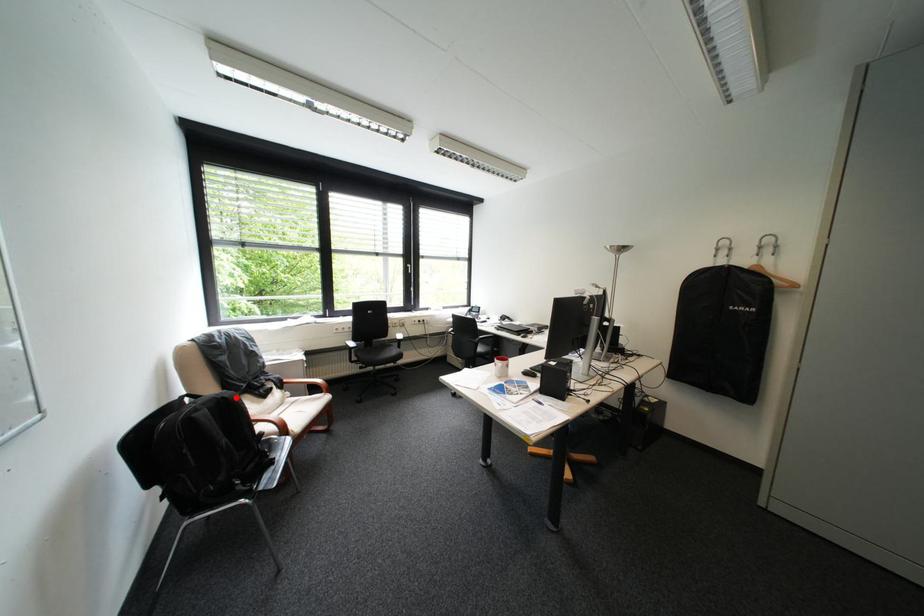
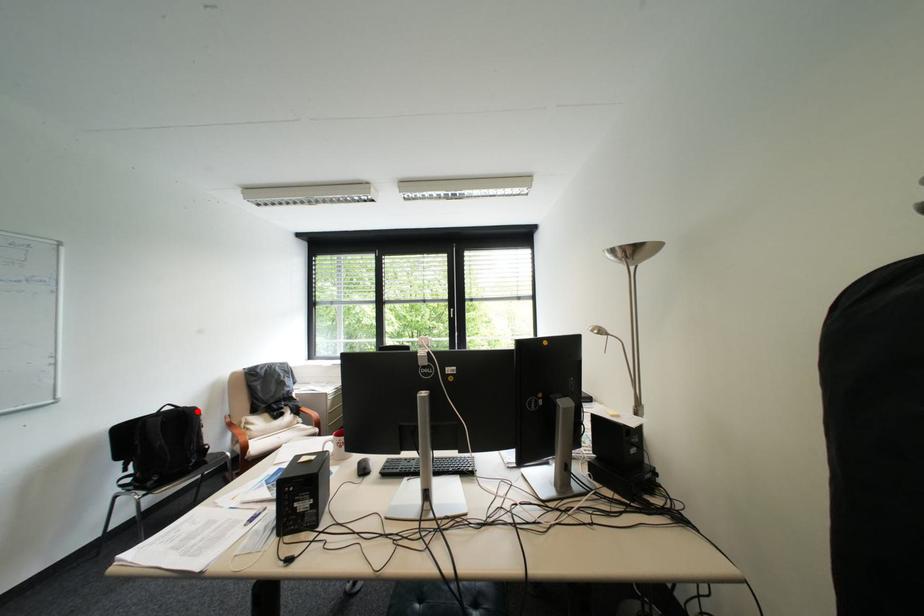
I am providing you with two images of the same scene from different viewpoints. A red point is marked on the first image and another point is marked on the second image. Does the point marked in image1 correspond to the same location as the one in image2?

Yes